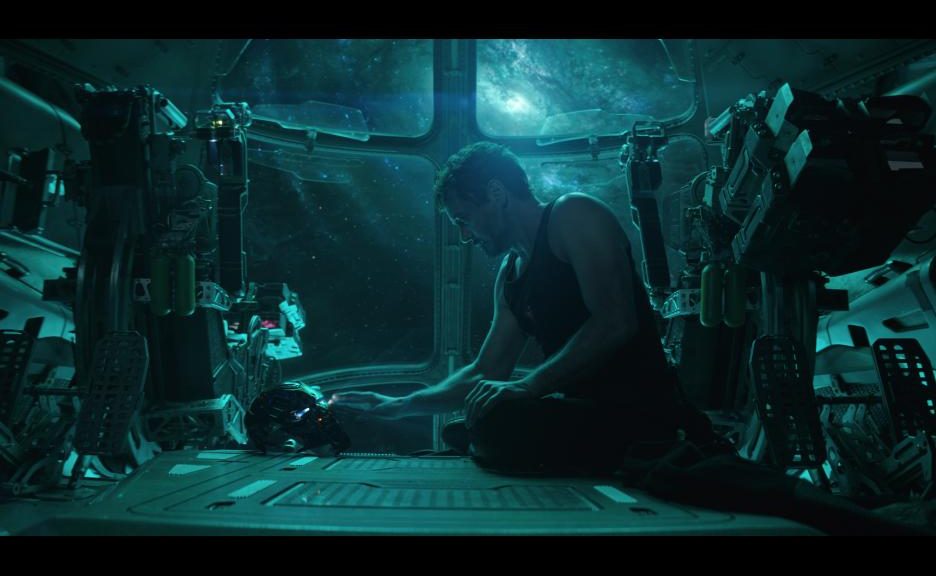
Locate an element on the screen. Image resolution: width=936 pixels, height=576 pixels. floor is located at coordinates (396, 495).